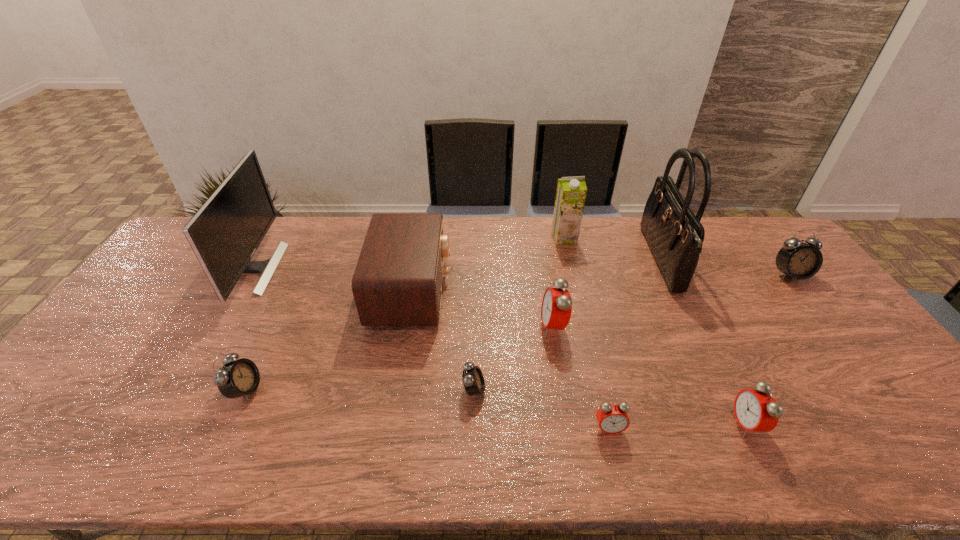
This screenshot has height=540, width=960. What are the coordinates of `the rightmost alarm clock` in the screenshot? It's located at (796, 259).

Identify the location of the rightmost object. (796, 259).

Identify the location of the leftmost alarm clock. (234, 379).

Identify the location of the second object from left to right. (234, 379).

This screenshot has height=540, width=960. In order to click on the second biggest red alarm clock in this screenshot , I will do `click(756, 410)`.

The height and width of the screenshot is (540, 960). I want to click on the fifth alarm clock from left to right, so click(756, 410).

At what (x,y) coordinates should I click in order to perform the action: click on the seventh object from right to left. Please return your answer as a coordinate pair (x, y). Image resolution: width=960 pixels, height=540 pixels. Looking at the image, I should click on 473,380.

What are the coordinates of `the second white alarm clock from right to left` in the screenshot? It's located at (473, 380).

Where is `the second red alarm clock from right to left`? the second red alarm clock from right to left is located at coordinates (612, 418).

This screenshot has width=960, height=540. Identify the location of the third alarm clock from right to left. (612, 418).